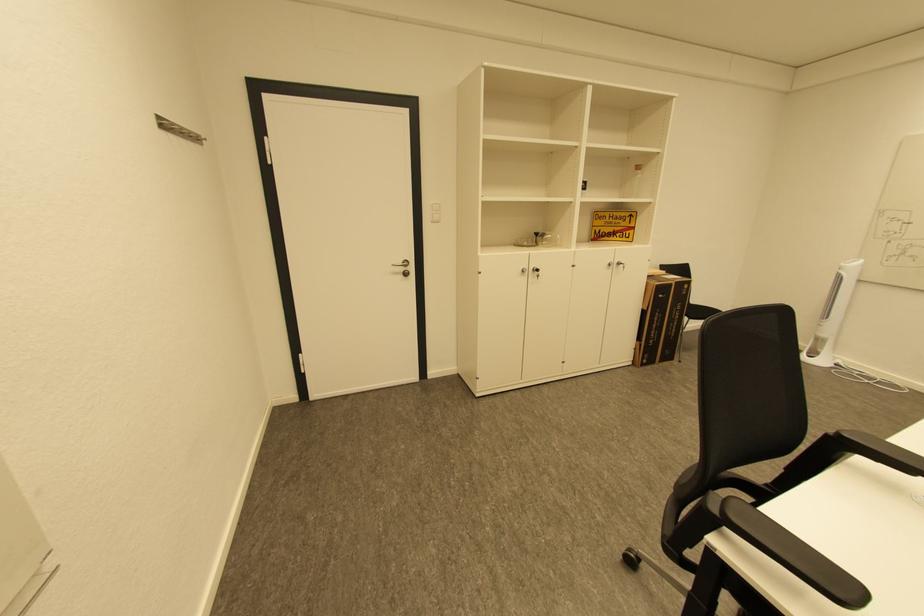
I want to click on cabinet key, so click(x=525, y=272).